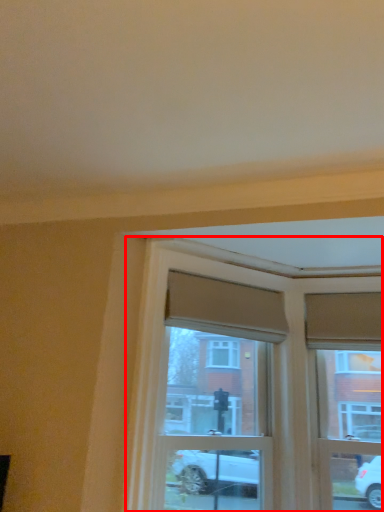
Question: From the image, what is the correct spatial relationship of window (annotated by the red box) in relation to window frame?

Choices:
 (A) right
 (B) left

Answer: (B)